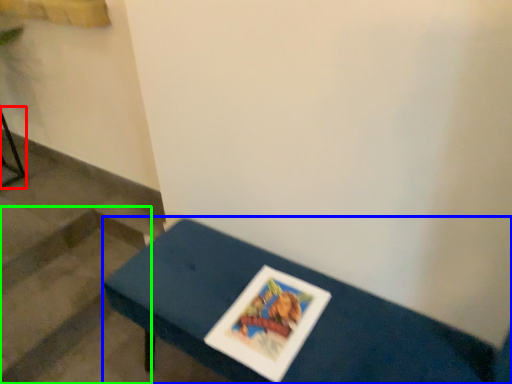
Question: Estimate the real-world distances between objects in this image. Which object is closer to furniture (highlighted by a red box), table (highlighted by a blue box) or stairwell (highlighted by a green box)?

Choices:
 (A) table
 (B) stairwell

Answer: (B)